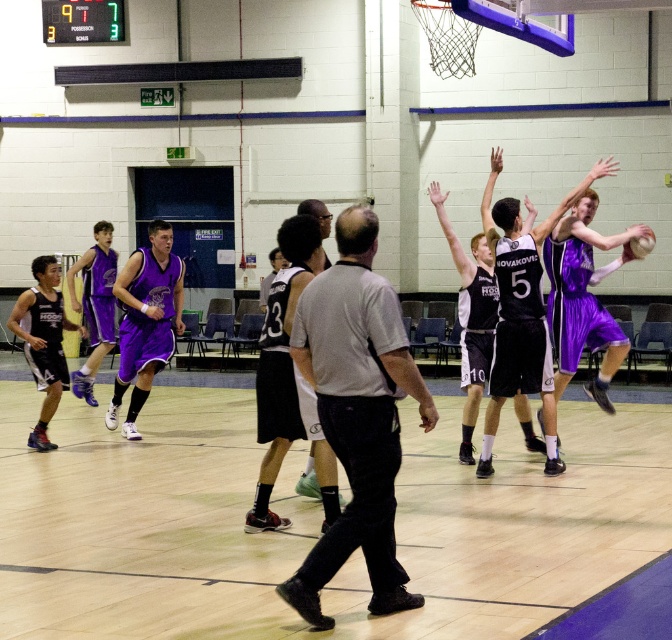
You are a spectator sitting in the bleachers watching the basketball game. You notice a gray shirt at center and a purple matte basketball at center. Which object is nearer to you?

The gray shirt at center is closer to the viewer than the purple matte basketball at center.

You are a referee in the middle of the basketball court. You see a gray shirt at center and a purple matte basketball at center. Which object is smaller in size?

The gray shirt at center is smaller in size compared to the purple matte basketball at center.

You are a referee in the gymnasium and need to determine if the point at coordinates (355, 413) falls on the gray shirt located at the center of the court. Based on the provided information, is this point on the gray shirt?

Yes, the point at coordinates (355, 413) is on the gray shirt at center as stated in the description.